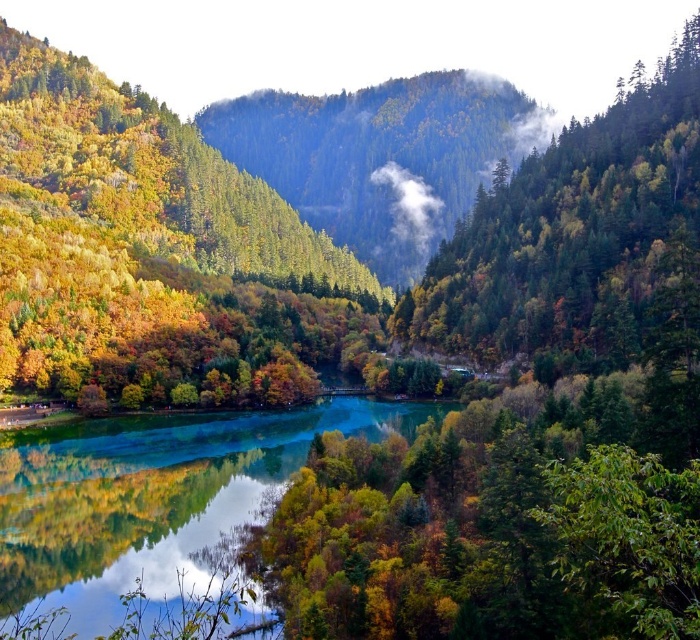
Who is positioned more to the left, green matte forest at center or green forested mountain at center?

From the viewer's perspective, green forested mountain at center appears more on the left side.

This screenshot has height=640, width=700. Describe the element at coordinates (564, 225) in the screenshot. I see `green matte forest at center` at that location.

What do you see at coordinates (564, 225) in the screenshot? I see `green matte forest at center` at bounding box center [564, 225].

Locate an element on the screen. green matte forest at center is located at coordinates (564, 225).

Does green reflective water at center have a lesser height compared to green forested mountain at center?

Yes, green reflective water at center is shorter than green forested mountain at center.

Between point (154, 454) and point (304, 218), which one is positioned behind?

Positioned behind is point (304, 218).

Locate an element on the screen. Image resolution: width=700 pixels, height=640 pixels. green reflective water at center is located at coordinates (154, 499).

Identify the location of green reflective water at center. (154, 499).

Between point (119, 602) and point (694, 211), which one is positioned behind?

The point (694, 211) is behind.

Between green reflective water at center and green matte forest at center, which one is positioned higher?

green matte forest at center

Describe the element at coordinates (154, 499) in the screenshot. The width and height of the screenshot is (700, 640). I see `green reflective water at center` at that location.

Image resolution: width=700 pixels, height=640 pixels. In order to click on green reflective water at center in this screenshot , I will do `click(154, 499)`.